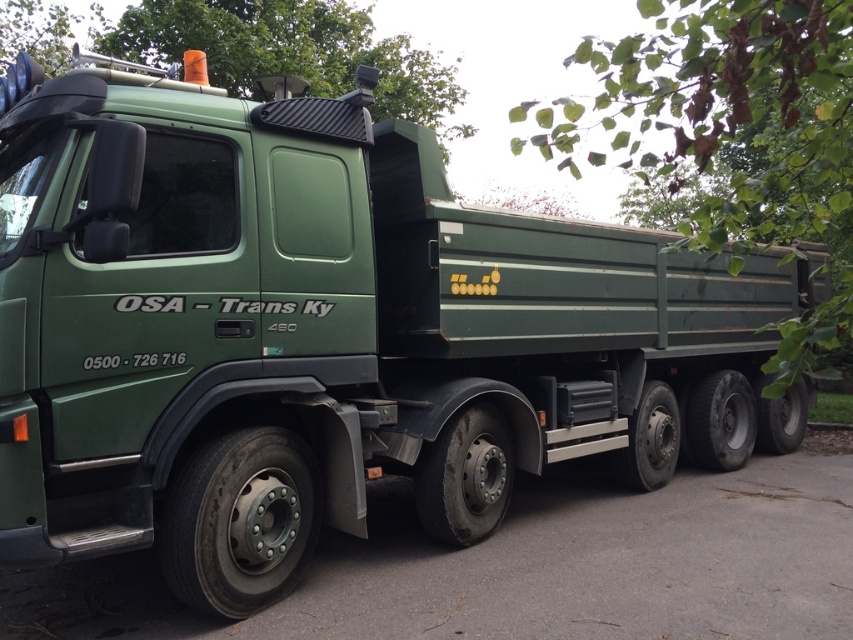
Question: Is green matte truck at center positioned in front of green corrugated metal roof at upper center?

Choices:
 (A) no
 (B) yes

Answer: (B)

Question: Does green matte truck at center have a smaller size compared to green corrugated metal roof at upper center?

Choices:
 (A) yes
 (B) no

Answer: (B)

Question: Can you confirm if green matte truck at center is bigger than green corrugated metal roof at upper center?

Choices:
 (A) no
 (B) yes

Answer: (B)

Question: Which point is closer to the camera taking this photo?

Choices:
 (A) (189, 1)
 (B) (850, 189)

Answer: (B)

Question: Which of the following is the closest to the observer?

Choices:
 (A) green matte truck at center
 (B) green corrugated metal roof at upper center

Answer: (A)